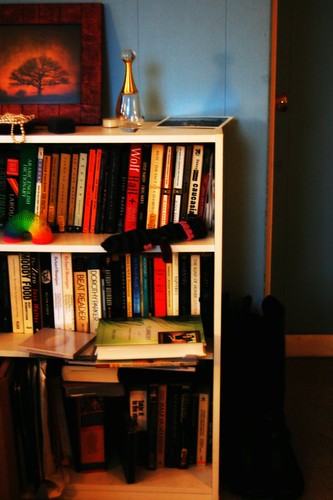
Locate an element on the screen. The image size is (333, 500). shelf is located at coordinates (59, 241), (79, 356), (91, 488), (126, 131).